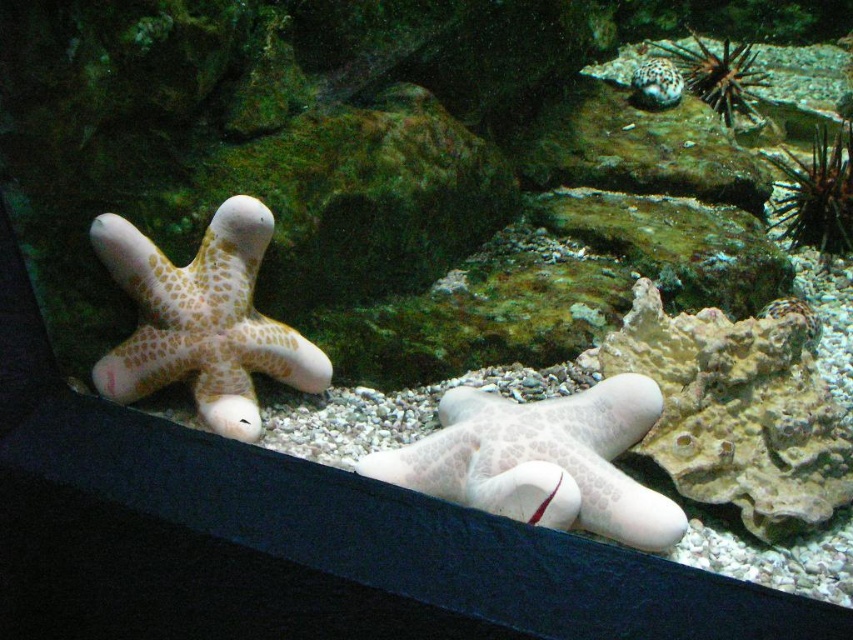
You are a marine biologist observing an underwater scene in an aquarium. You notice a brown spiky sea urchin at right and a speckled white starfish at upper right. Based on their positions and sizes, which one do you think would block a small robotic diver moving from the center of the image towards the right edge?

The brown spiky sea urchin at right might block the robotic diver since it is wider than the speckled white starfish at upper right and positioned closer to the right edge of the image.

You are an underwater photographer aiming to capture the white matte starfish at center. You are currently positioned at point [543,460]. Can you determine the direction you need to move to locate the starfish?

The white matte starfish at center is located at point [543,460], so you are already at the correct position to capture it.

You are an underwater photographer aiming to capture a closeup of the white matte starfish at center and the sandy textured starfish at upper right. Which starfish should you focus on first if you want to take a photo that includes both in the frame without moving the camera?

The white matte starfish at center is closer to the camera than the sandy textured starfish at upper right, so focusing on it first would ensure both are in the frame.